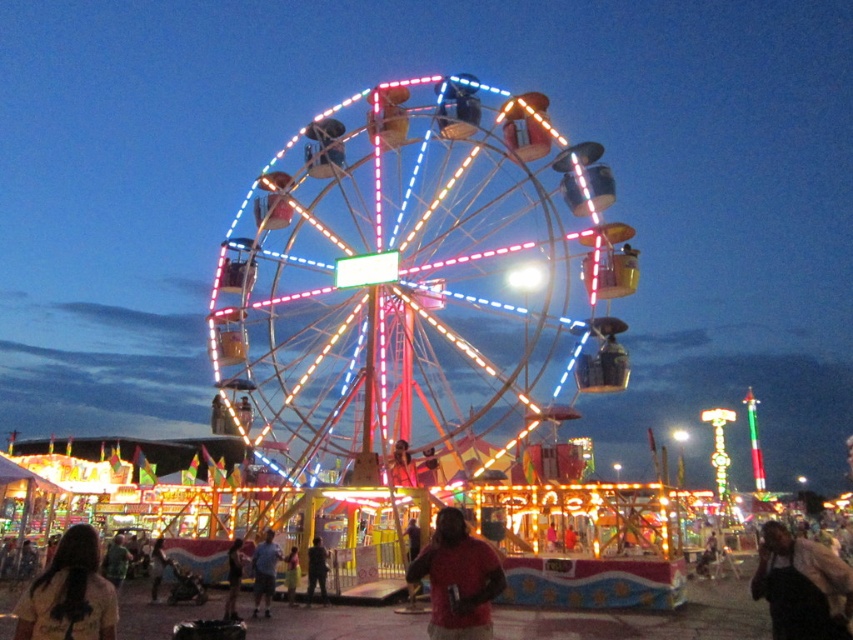
Question: Estimate the real-world distances between objects in this image. Which object is farther from the matte red shirt at center?

Choices:
 (A) illuminated metal ferris wheel at center
 (B) dark gray pants at center
 (C) smooth blue shirt at center
 (D) light brown leather jacket at center

Answer: (A)

Question: Does dark gray fabric shirt at lower right have a larger size compared to brown fabric shirt at lower left?

Choices:
 (A) no
 (B) yes

Answer: (B)

Question: Considering the real-world distances, which object is closest to the brown fabric shirt at lower left?

Choices:
 (A) dark gray fabric shirt at lower right
 (B) illuminated metal ferris wheel at center
 (C) smooth blue shirt at center
 (D) matte red shirt at center

Answer: (C)

Question: Is matte red shirt at center bigger than smooth blue shirt at center?

Choices:
 (A) no
 (B) yes

Answer: (B)

Question: Which object is positioned farthest from the light brown leather jacket at center?

Choices:
 (A) dark gray pants at center
 (B) brown fabric shirt at lower left
 (C) dark gray fabric shirt at lower right
 (D) smooth blue shirt at center

Answer: (C)

Question: Does matte red shirt at center have a lesser width compared to brown fabric shirt at lower left?

Choices:
 (A) yes
 (B) no

Answer: (B)